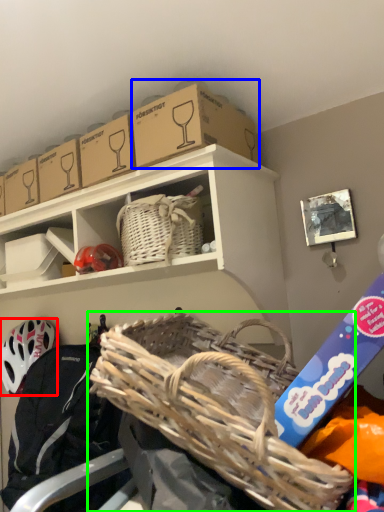
Question: Which object is positioned farthest from helmet (highlighted by a red box)? Select from storage box (highlighted by a blue box) and picnic basket (highlighted by a green box).

Choices:
 (A) storage box
 (B) picnic basket

Answer: (A)